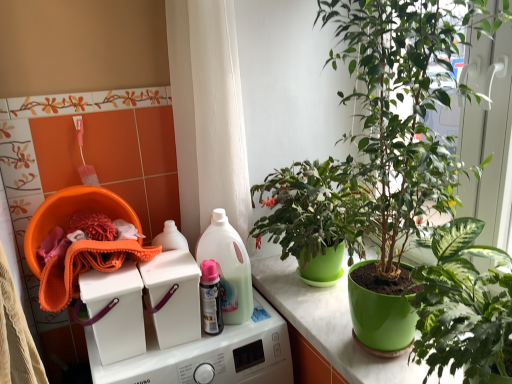
Question: Would you say translucent plastic bottle at center is to the left or to the right of pink glossy spray can at center in the picture?

Choices:
 (A) right
 (B) left

Answer: (A)

Question: From a real-world perspective, relative to pink glossy spray can at center, is translucent plastic bottle at center vertically above or below?

Choices:
 (A) below
 (B) above

Answer: (B)

Question: Which is nearer to the translucent plastic bottle at center?

Choices:
 (A) pink glossy spray can at center
 (B) white plastic washing machine at center, which is the third washing machine from top to bottom
 (C) white plastic washing machine at upper center, which is the 2th washing machine from top to bottom
 (D) white plastic washing machine at center, the 3th washing machine when ordered from bottom to top
 (E) green glossy pot at right, positioned as the first houseplant in bottom-to-top order

Answer: (A)

Question: Which object is the farthest from the white plastic washing machine at center, which is the third washing machine from top to bottom?

Choices:
 (A) white plastic washing machine at upper center, which is the 2th washing machine from top to bottom
 (B) orange microfiber cloth at left
 (C) green glossy pot at right, positioned as the first houseplant in bottom-to-top order
 (D) white plastic washing machine at center, the 3th washing machine when ordered from bottom to top
 (E) pink glossy spray can at center

Answer: (C)